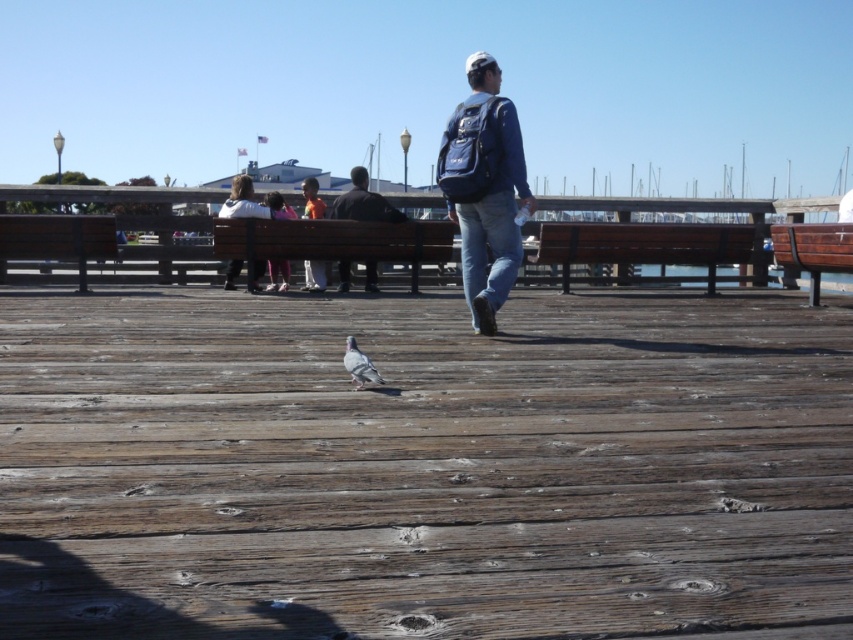
Does brown wooden deck at center have a greater width compared to white cotton jacket at center?

No.

Looking at this image, can you confirm if brown wooden deck at center is bigger than white cotton jacket at center?

Actually, brown wooden deck at center might be smaller than white cotton jacket at center.

What do you see at coordinates (422, 467) in the screenshot? This screenshot has width=853, height=640. I see `brown wooden deck at center` at bounding box center [422, 467].

At what (x,y) coordinates should I click in order to perform the action: click on brown wooden deck at center. Please return your answer as a coordinate pair (x, y). The height and width of the screenshot is (640, 853). Looking at the image, I should click on (422, 467).

Describe the element at coordinates (422, 467) in the screenshot. I see `brown wooden deck at center` at that location.

Does point (677, 312) come farther from viewer compared to point (354, 358)?

Yes, it is.

The width and height of the screenshot is (853, 640). What do you see at coordinates (422, 467) in the screenshot?
I see `brown wooden deck at center` at bounding box center [422, 467].

Locate an element on the screen. The image size is (853, 640). brown wooden deck at center is located at coordinates (422, 467).

Between dark brown leather jacket at center and matte pink shirt at center, which one is positioned lower?

matte pink shirt at center is lower down.

Can you confirm if dark brown leather jacket at center is thinner than matte pink shirt at center?

In fact, dark brown leather jacket at center might be wider than matte pink shirt at center.

Is point (364, 260) closer to camera compared to point (274, 276)?

Yes, it is in front of point (274, 276).

Locate an element on the screen. The width and height of the screenshot is (853, 640). dark brown leather jacket at center is located at coordinates (363, 202).